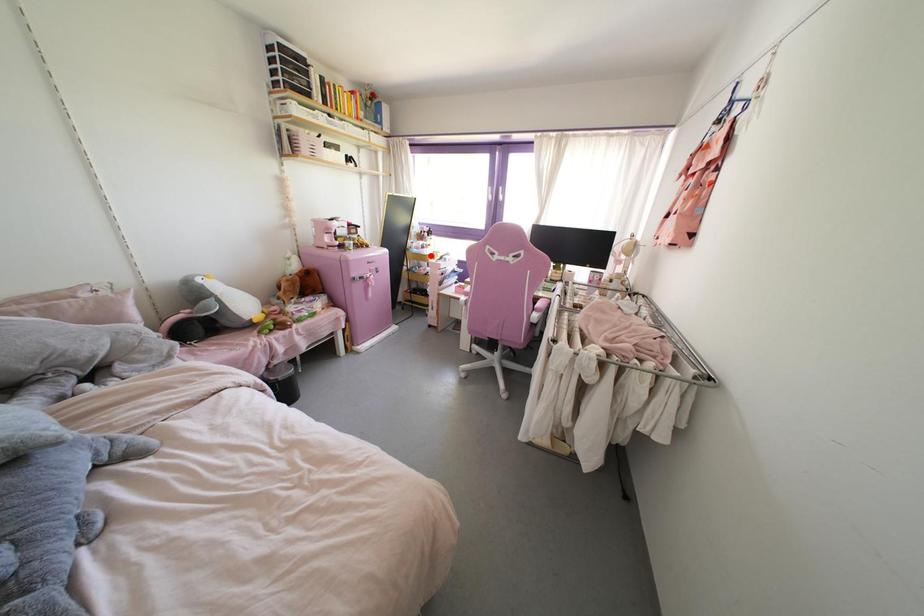
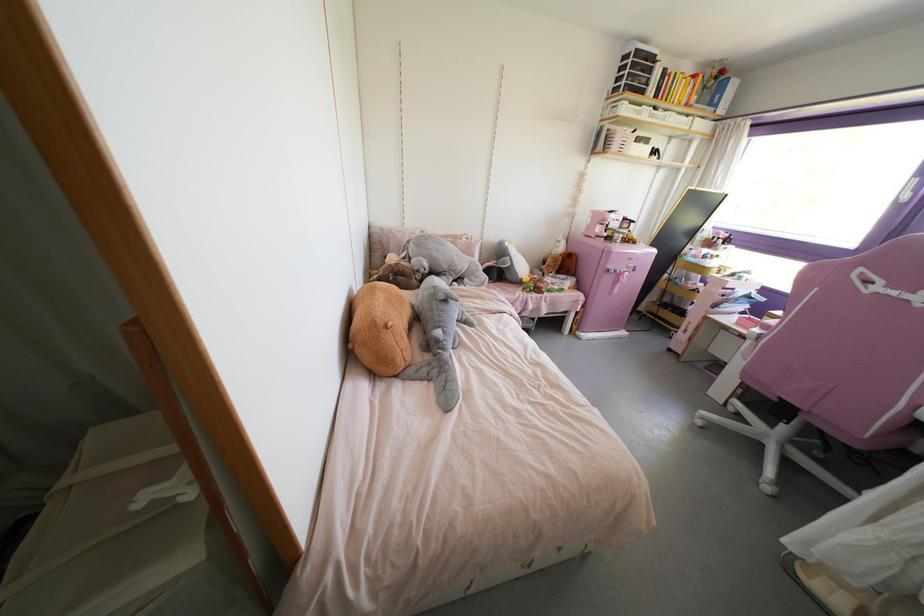
In the second image, find the point that corresponds to the highlighted location in the first image.

(713, 270)